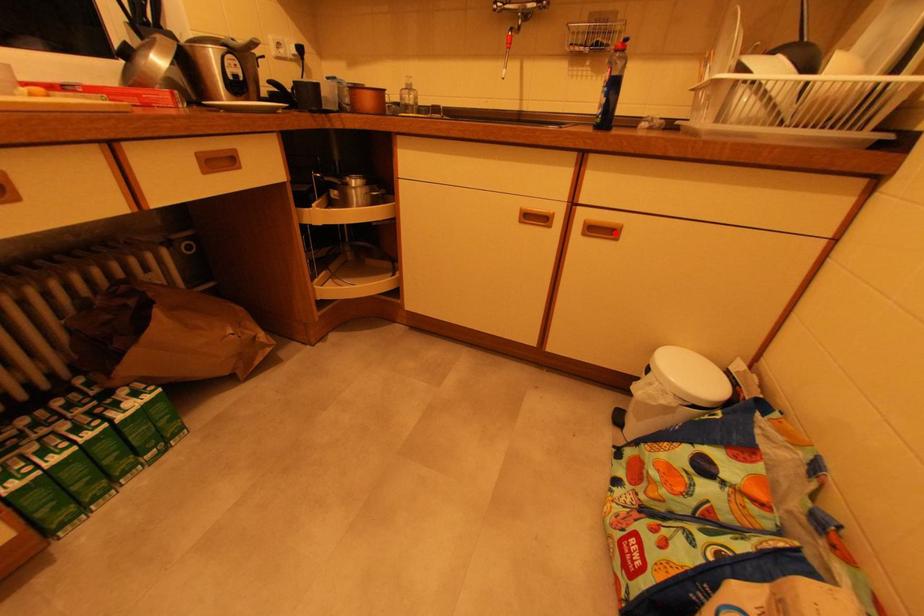
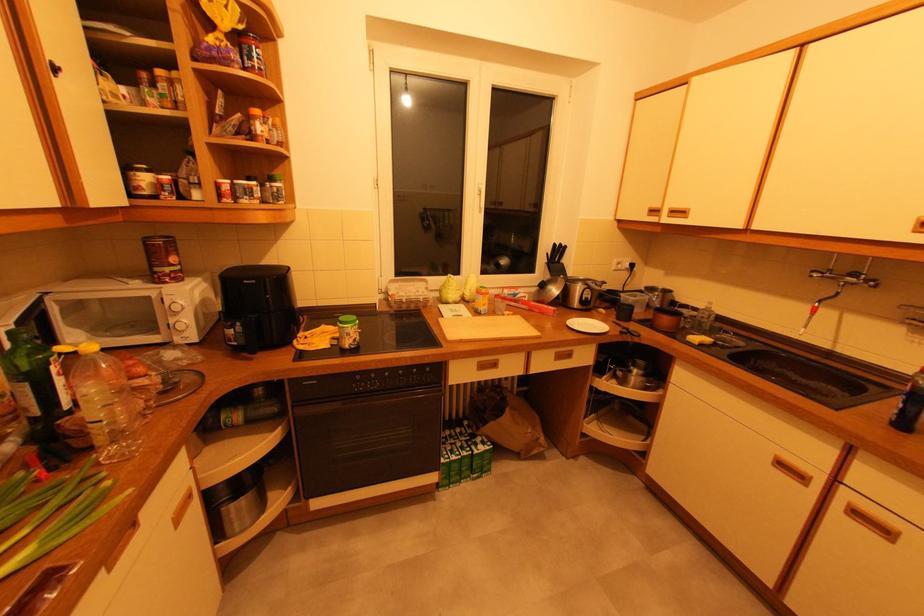
The point at the highlighted location is marked in the first image. Where is the corresponding point in the second image?

(889, 532)